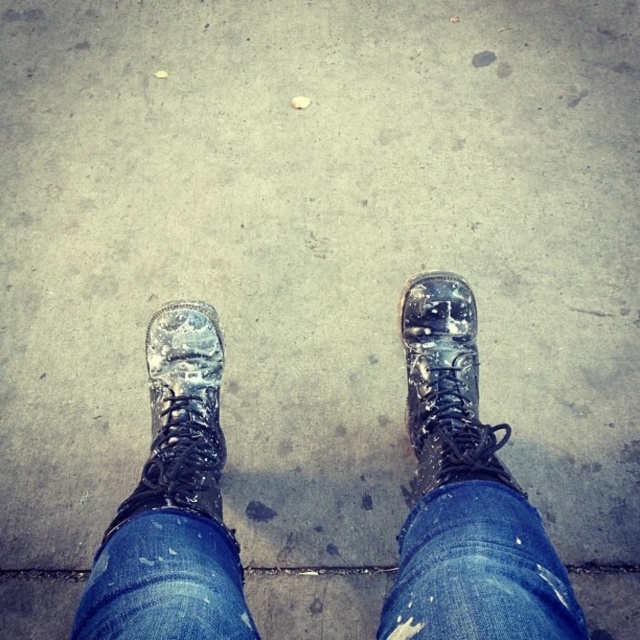
You are a shoe salesperson who needs to determine the correct size for a customer. You observe the wet leather boot at lower left and the glossy leather boot at center in the image. Which boot has a larger width measurement?

The wet leather boot at lower left has a larger width measurement than the glossy leather boot at center, as stated in the description.

You are a photographer trying to capture the texture of the boots in the image. You notice two wet leather boots at center and a wet leather boot at lower left. Which boot should you focus on to get a clearer image of the one closer to the camera?

The wet leather boots at center is in front of the wet leather boot at lower left, so focusing on the wet leather boots at center will give a clearer image of the boot closer to the camera.